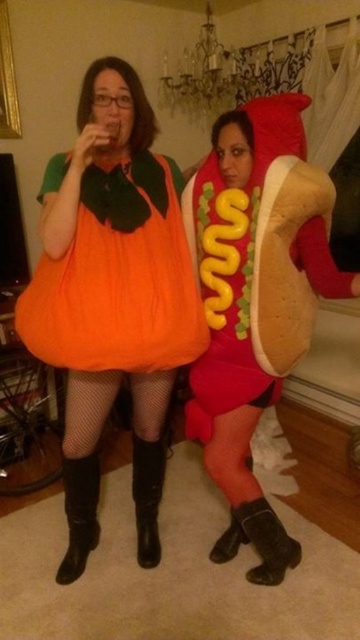
You are a costume designer who needs to decide which object to place in the foreground for a Halloween display. The orange fabric pumpkin at center and the black leather boot at lower left are both candidates. Based on their sizes, which one should you choose to emphasize the Halloween theme?

The orange fabric pumpkin at center is larger in size than the black leather boot at lower left, so it would be better to choose the orange fabric pumpkin at center for the foreground to emphasize the Halloween theme since it is bigger and more eye catching.

You are a photographer setting up a shoot with two orange fabric items in the scene. You need to arrange them so that the narrower item is placed to the right of the wider one. Given the orange fabric pumpkin at center and the orange fabric dress at left, which item should you move and where?

The orange fabric pumpkin at center is narrower than the orange fabric dress at left. To follow the arrangement, you should move the orange fabric pumpkin at center to the right side of the orange fabric dress at left.

You are a photographer setting up for a Halloween photoshoot. You need to position the orange fabric pumpkin at center so that it is visible in the frame without being blocked by the black leather boot at lower left. Based on the scene description, where should you place the pumpkin relative to the boot?

The orange fabric pumpkin at center is above the black leather boot at lower left, so placing the pumpkin above the boot will ensure it remains visible and unobstructed in the frame.